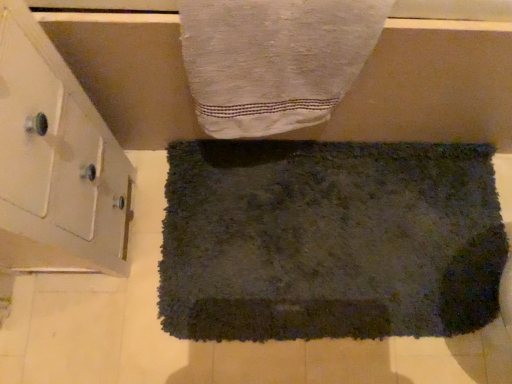
Locate an element on the screen. The image size is (512, 384). free space in front of white glossy cabinet at left is located at coordinates (74, 326).